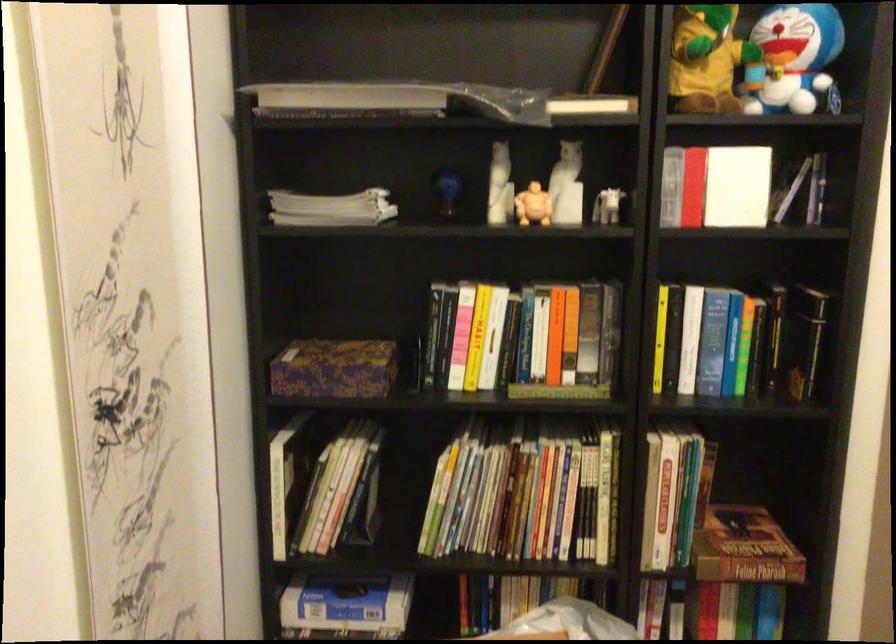
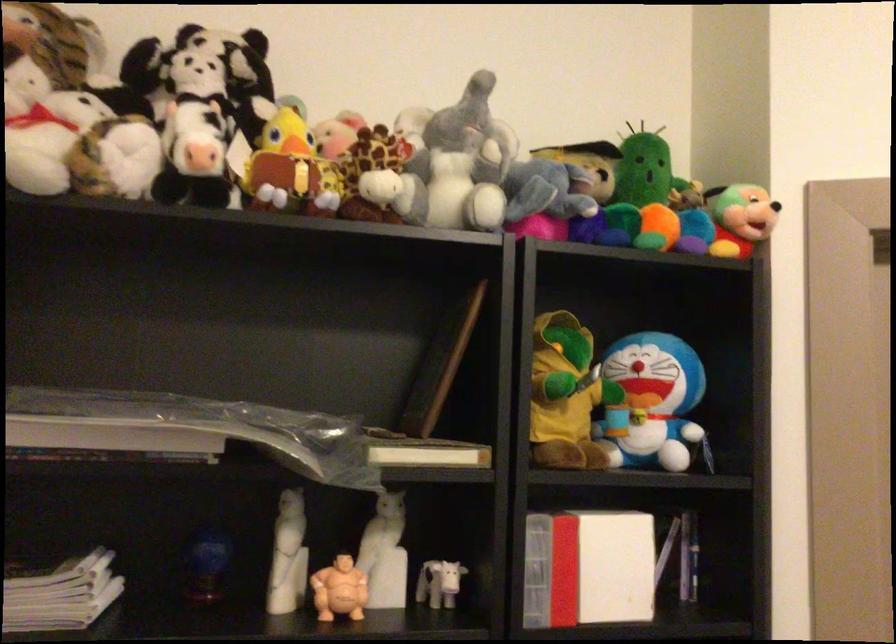
In the second image, find the point that corresponds to [566,184] in the first image.

(384, 554)